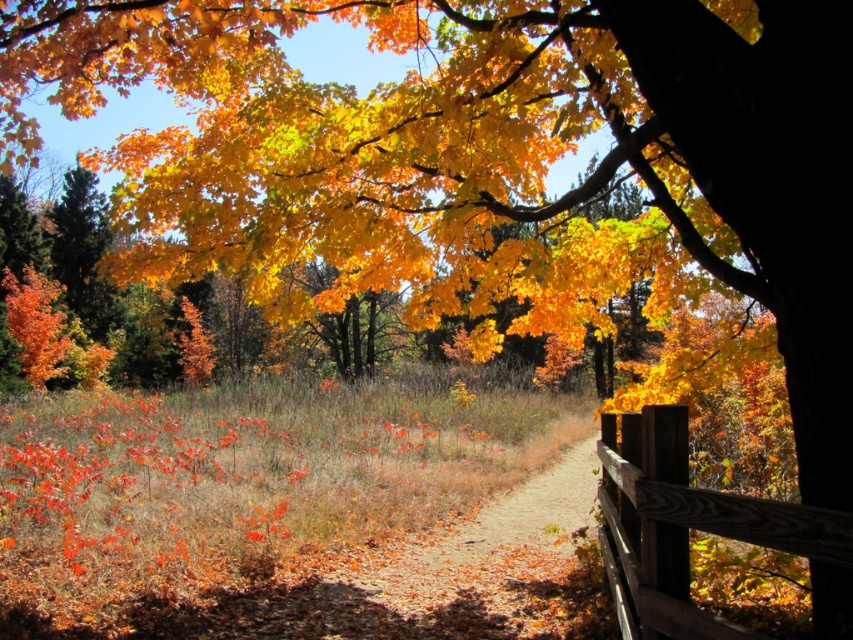
Question: Is brown dirt path at center below brown wooden fence at lower right?

Choices:
 (A) yes
 (B) no

Answer: (A)

Question: Which object is farther from the camera taking this photo?

Choices:
 (A) brown wooden fence at lower right
 (B) brown dirt path at center

Answer: (B)

Question: In this image, where is brown dirt path at center located relative to brown wooden fence at lower right?

Choices:
 (A) right
 (B) left

Answer: (A)

Question: Which of the following is the farthest from the observer?

Choices:
 (A) brown dirt path at center
 (B) brown wooden fence at lower right

Answer: (A)

Question: Is brown dirt path at center above brown wooden fence at lower right?

Choices:
 (A) yes
 (B) no

Answer: (B)